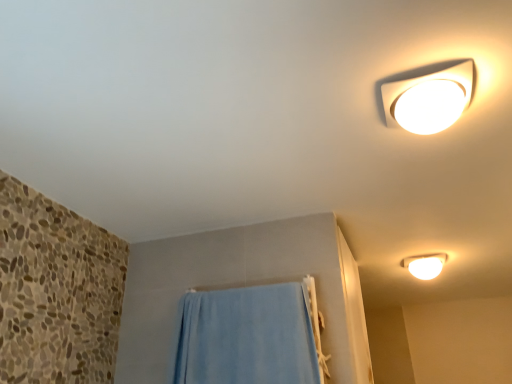
Question: Which is correct: blue fabric towel at lower center is inside white glossy ceiling light at upper right, the 2th lamp positioned from the bottom, or outside of it?

Choices:
 (A) inside
 (B) outside

Answer: (B)

Question: Looking at the image, does blue fabric towel at lower center seem bigger or smaller compared to white glossy ceiling light at upper right, the second lamp from the right?

Choices:
 (A) big
 (B) small

Answer: (A)

Question: Considering the real-world distances, which object is closest to the white glossy ceiling light at upper right, which is the first lamp from front to back?

Choices:
 (A) white glossy light fixture at upper right, placed as the second lamp when sorted from left to right
 (B) blue fabric towel at lower center

Answer: (B)

Question: Which of these objects is positioned farthest from the white glossy light fixture at upper right, the first lamp positioned from the right?

Choices:
 (A) white glossy ceiling light at upper right, the 2th lamp positioned from the bottom
 (B) blue fabric towel at lower center

Answer: (A)